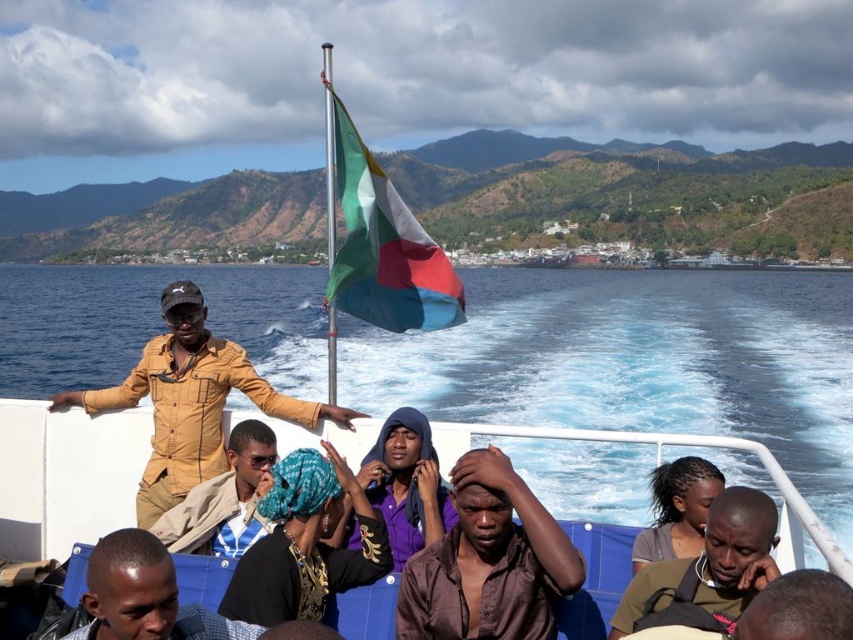
Question: Which point appears closest to the camera in this image?

Choices:
 (A) (325, 460)
 (B) (352, 240)
 (C) (416, 419)
 (D) (769, 452)

Answer: (A)

Question: Can you confirm if smooth brown shirt at lower left is bigger than tan leather jacket at center?

Choices:
 (A) yes
 (B) no

Answer: (B)

Question: Considering the relative positions of blue water at lower left and polyester flag at upper center in the image provided, where is blue water at lower left located with respect to polyester flag at upper center?

Choices:
 (A) left
 (B) right

Answer: (A)

Question: Which object appears closest to the camera in this image?

Choices:
 (A) tan leather jacket at center
 (B) brown leather jacket at lower right
 (C) smooth brown shirt at lower left

Answer: (C)

Question: Among these objects, which one is farthest from the camera?

Choices:
 (A) brown matte shirt at center
 (B) purple matte clothing at center

Answer: (B)

Question: In this image, where is purple matte clothing at center located relative to dark brown hair at center?

Choices:
 (A) below
 (B) above

Answer: (B)